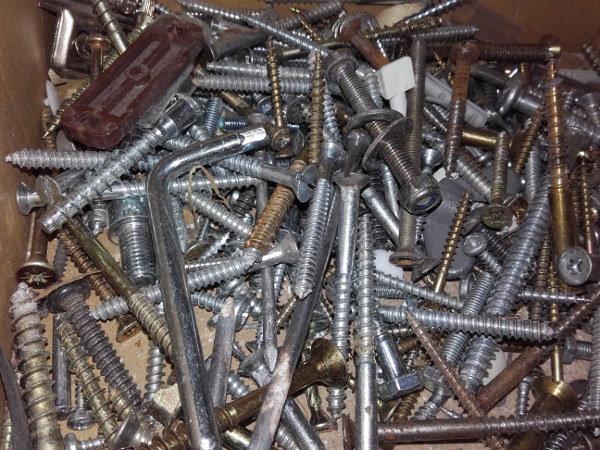
At what (x,y) coordinates should I click in order to perform the action: click on hinge. Please return your answer as a coordinate pair (x, y). This screenshot has height=450, width=600. Looking at the image, I should click on pyautogui.click(x=62, y=57).